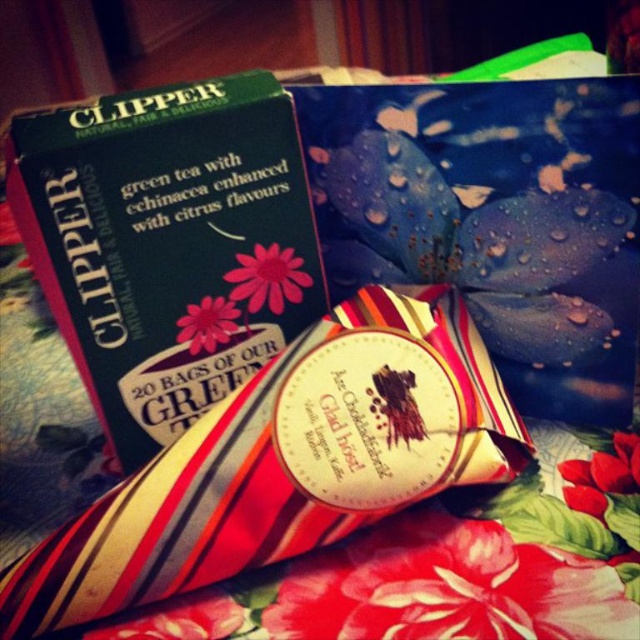
You are holding a camera 12 inches away from the red matte flower at center. Can you confirm if the flower is in focus?

The red matte flower at center is 13.36 inches from the camera. Since your camera is only 12 inches away, the flower is slightly farther than the camera focus distance, so it might be out of focus.

You are organizing a gift table and see the pink matte flower at center and the pink paper flower at upper left. Which one is closer to you?

The pink matte flower at center is closer to you because the pink paper flower at upper left is behind it.